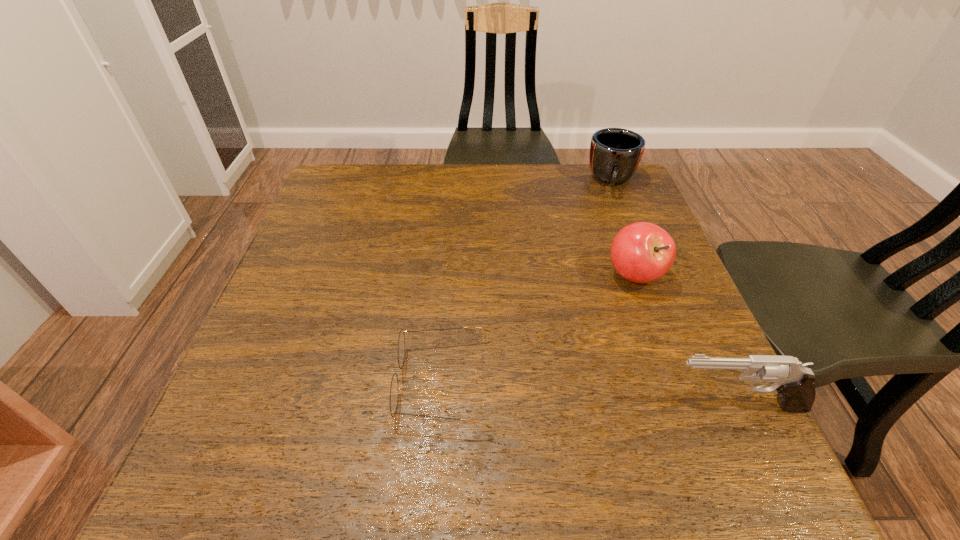
Where is `free space on the desktop that is between the spectacles and the gun and is positioned on the stem of the second farthest object`? free space on the desktop that is between the spectacles and the gun and is positioned on the stem of the second farthest object is located at coordinates (607, 395).

At what (x,y) coordinates should I click in order to perform the action: click on free spot on the desktop that is between the shortest object and the gun and is positioned on the side of the mug with the handle. Please return your answer as a coordinate pair (x, y). This screenshot has width=960, height=540. Looking at the image, I should click on (603, 395).